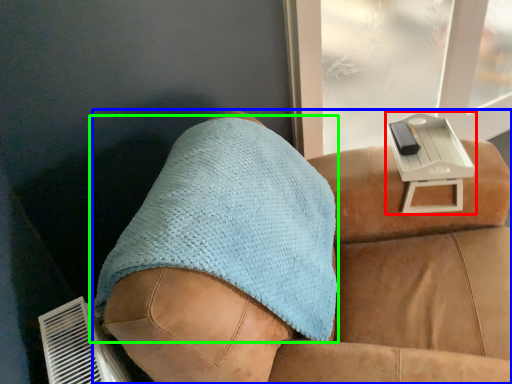
Question: Based on their relative distances, which object is farther from table (highlighted by a red box)? Choose from furniture (highlighted by a blue box) and throw pillow (highlighted by a green box).

Choices:
 (A) furniture
 (B) throw pillow

Answer: (B)